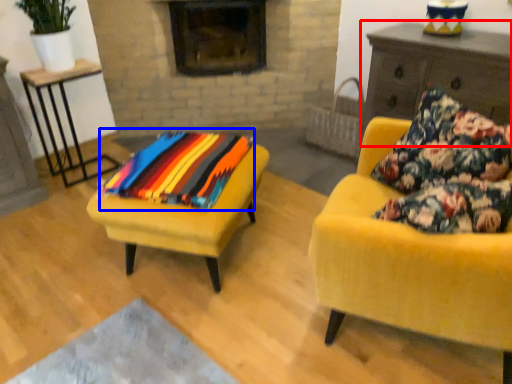
Question: Which point is further to the camera, dresser (highlighted by a red box) or blanket (highlighted by a blue box)?

Choices:
 (A) dresser
 (B) blanket

Answer: (A)